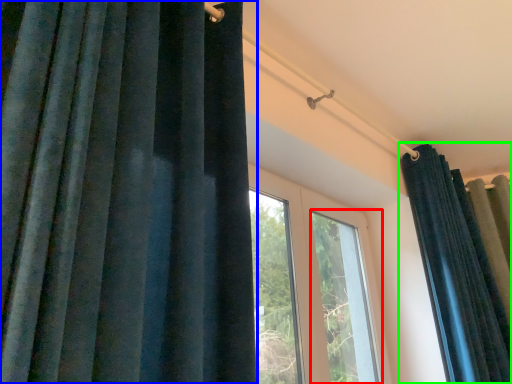
Question: Considering the real-world distances, which object is closest to window (highlighted by a red box)? curtain (highlighted by a blue box) or curtain (highlighted by a green box).

Choices:
 (A) curtain
 (B) curtain

Answer: (B)